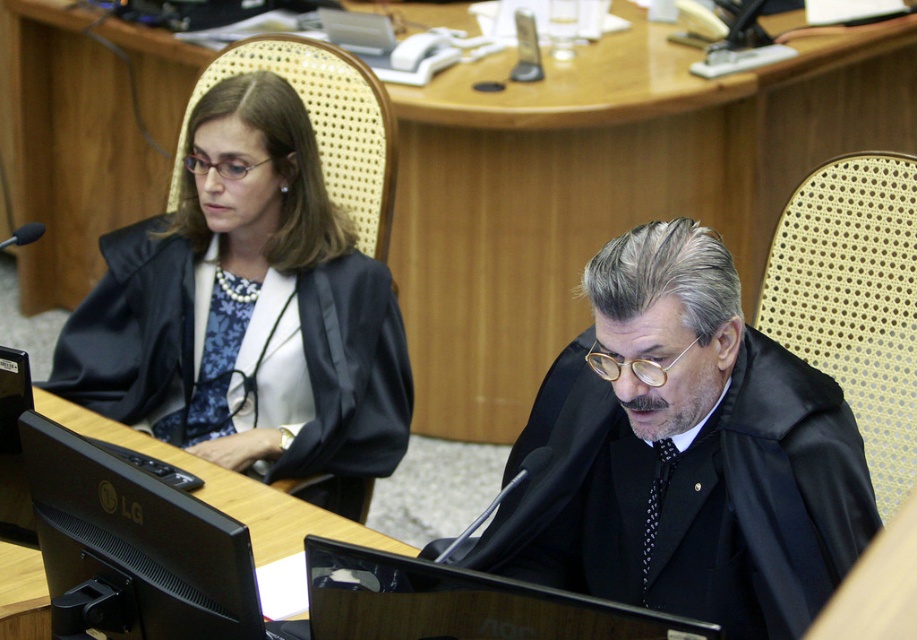
You are an assistant in a courtroom and need to determine which robe is taller between the satin black robe at left and the black matte robe at center. Based on the scene, which one is taller?

The satin black robe at left is taller than the black matte robe at center.

You are an assistant in a courtroom. You need to place a small document on the desk between the satin black robe at left and the black matte robe at center. Where should you place it so it is between them?

The satin black robe at left is above the black matte robe at center, so placing the document between them would require positioning it below the satin black robe at left and above the black matte robe at center.